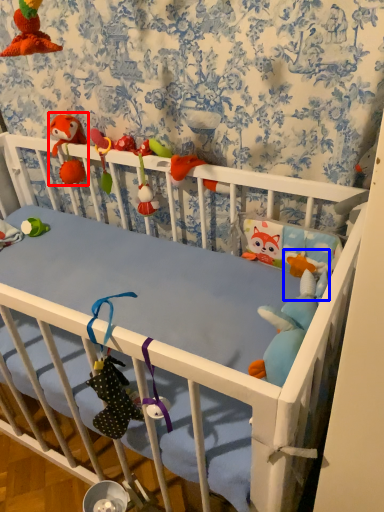
Question: Which of the following is the closest to the observer, toy (highlighted by a red box) or toy (highlighted by a blue box)?

Choices:
 (A) toy
 (B) toy

Answer: (B)